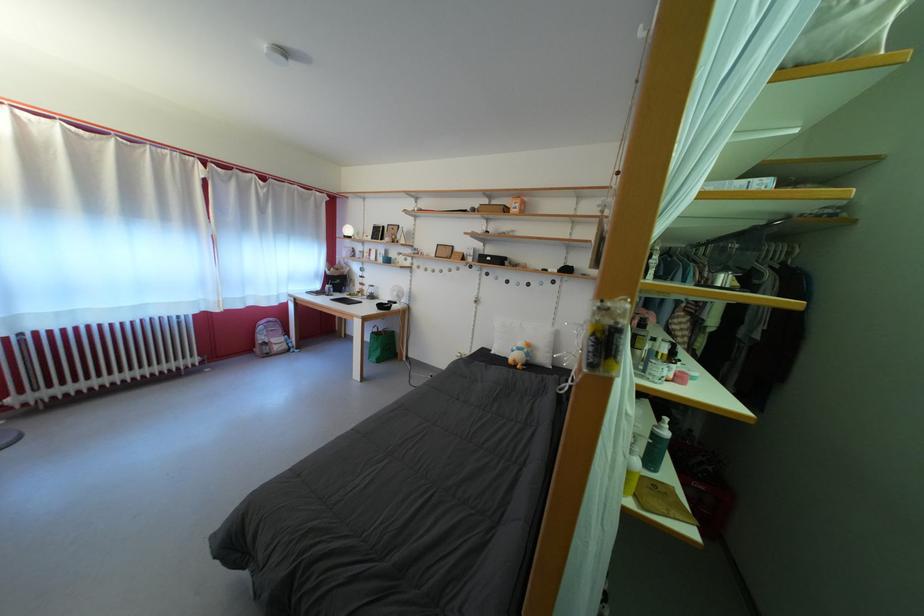
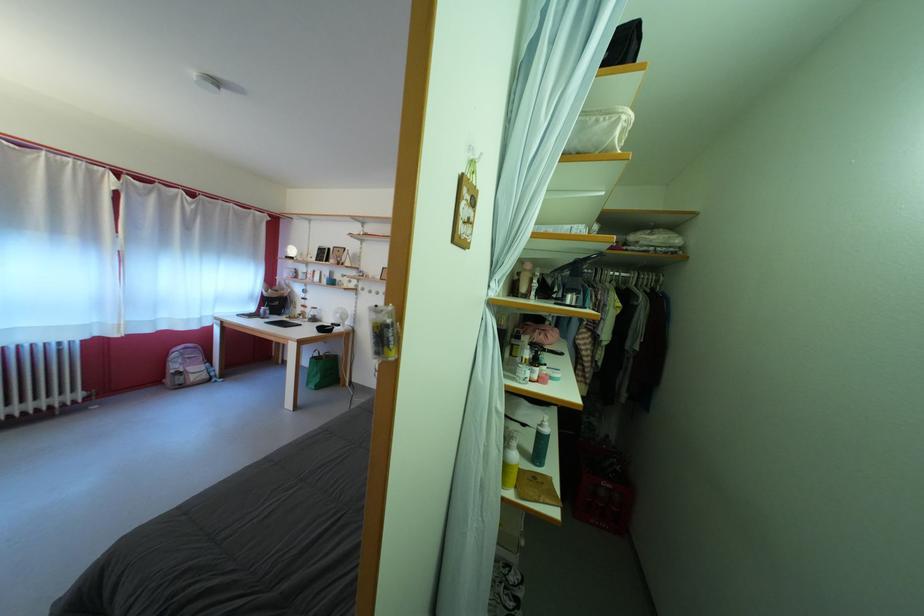
The point at (x=381, y=302) is marked in the first image. Where is the corresponding point in the second image?

(322, 325)